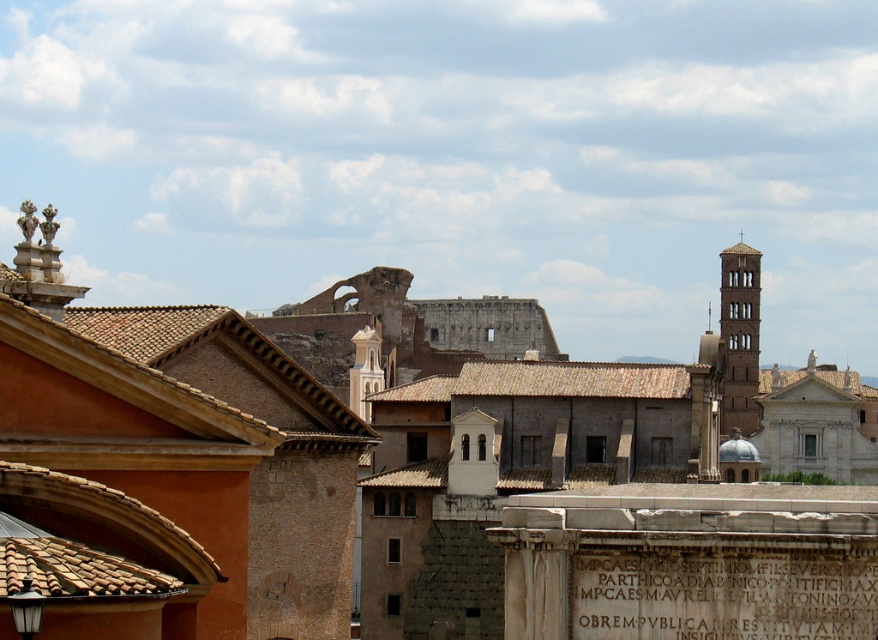
You are standing in the historic urban landscape and want to take a photo of the brown stone building at center. If your camera has a maximum focus range of 35 meters, will you need to move closer to capture a clear image?

The brown stone building at center is 37.28 meters away from the viewer. Since the camera can only focus up to 35 meters, you need to move closer to ensure the building is within the camera range.

You are an architect examining the historic urban landscape. You need to determine which structure is nearer to you between the brown stone building at center and the brown stone tower at right. Which one is closer?

The brown stone building at center is closer to the viewer than the brown stone tower at right.

You are standing in the historic urban landscape and want to take a photo of both the brown stone building at center and the brown stone tower at right. Since you can only focus on one at a time, which one should you position closer to the camera to include both in the frame?

To include both the brown stone building at center and the brown stone tower at right in the frame while focusing on one, position the camera closer to the brown stone building at center since it is located to the left of the brown stone tower at right, allowing both to be captured within the same shot.